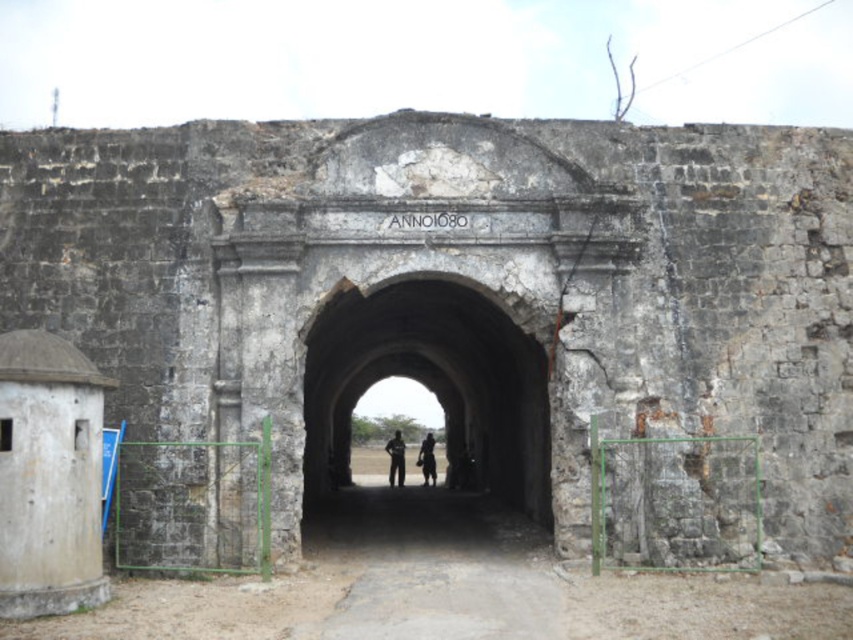
Question: Does black matte person at center have a smaller size compared to dark skin textured person at center?

Choices:
 (A) yes
 (B) no

Answer: (B)

Question: Considering the relative positions of black matte person at center and dark skin textured person at center in the image provided, where is black matte person at center located with respect to dark skin textured person at center?

Choices:
 (A) below
 (B) above

Answer: (B)

Question: Is black matte person at center to the left of dark skin textured person at center from the viewer's perspective?

Choices:
 (A) no
 (B) yes

Answer: (B)

Question: Which point is closer to the camera?

Choices:
 (A) (492, 358)
 (B) (433, 464)

Answer: (A)

Question: Which point is farther from the camera taking this photo?

Choices:
 (A) (428, 467)
 (B) (525, 412)
 (C) (403, 449)

Answer: (A)

Question: Which point is closer to the camera taking this photo?

Choices:
 (A) (390, 468)
 (B) (428, 438)

Answer: (B)